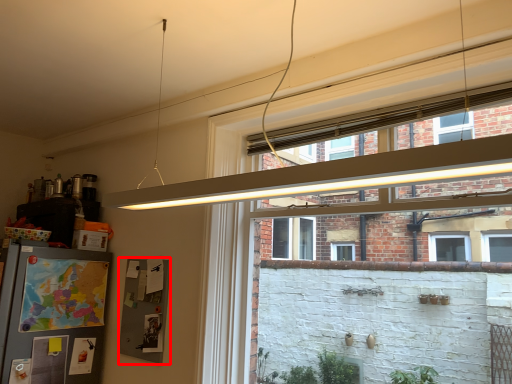
Question: From the image's perspective, considering the relative positions of bulletin board (annotated by the red box) and window in the image provided, where is bulletin board (annotated by the red box) located with respect to the staircase?

Choices:
 (A) above
 (B) below

Answer: (B)